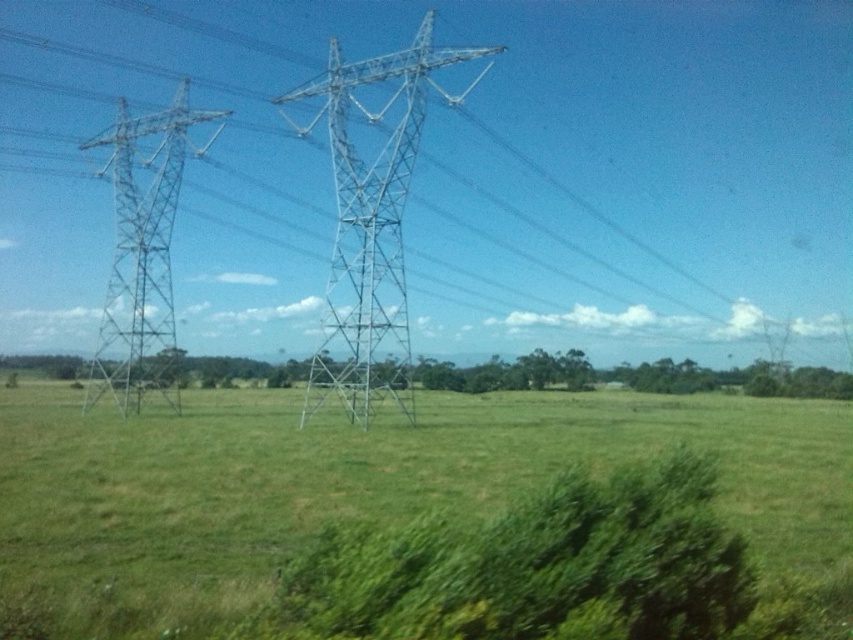
Question: Can you confirm if green grassy field at center is positioned to the right of metallic silver tower at left?

Choices:
 (A) no
 (B) yes

Answer: (B)

Question: Estimate the real-world distances between objects in this image. Which object is farther from the green grassy field at center?

Choices:
 (A) metallic silver tower at left
 (B) metallic silver tower at center
 (C) metallic silver power line at left

Answer: (C)

Question: Can you confirm if metallic silver tower at center is smaller than metallic silver tower at left?

Choices:
 (A) no
 (B) yes

Answer: (A)

Question: Among these objects, which one is farthest from the camera?

Choices:
 (A) metallic silver tower at left
 (B) metallic silver power line at left
 (C) green grassy field at center

Answer: (A)

Question: Based on their relative distances, which object is farther from the metallic silver tower at center?

Choices:
 (A) green grassy field at center
 (B) metallic silver power line at left
 (C) metallic silver tower at left

Answer: (A)

Question: Is the position of metallic silver power line at left less distant than that of green grassy field at center?

Choices:
 (A) yes
 (B) no

Answer: (B)